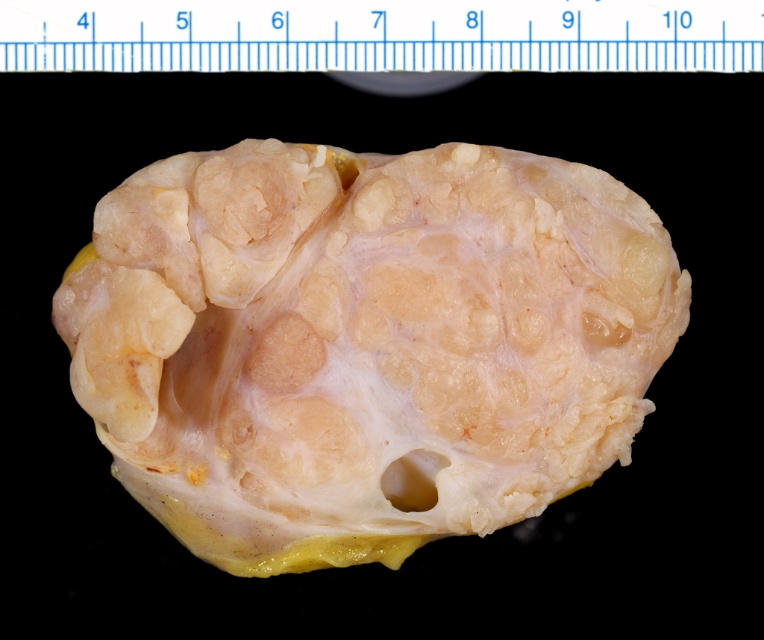
Consider the image. You are a medical student examining a tissue sample. You see the translucent yellowish flesh at center and the white plastic ruler at upper center. Which object is closer to you?

The white plastic ruler at upper center is closer to you because the translucent yellowish flesh at center is positioned under it.

From the picture: You are a surgeon preparing to perform a biopsy on the translucent yellowish flesh at center. The biopsy tool you have can only reach 3 feet. Can you safely perform the biopsy without moving the tool closer?

The distance between the surgeon and the translucent yellowish flesh at center is 3.75 feet, which is beyond the 3 feet reach of the biopsy tool. Therefore, the surgeon cannot safely perform the biopsy without moving the tool closer.

You are a medical student examining a tissue sample. You observe the translucent yellowish flesh at center. Based on its coordinates, where exactly is this feature positioned in the image?

The translucent yellowish flesh at center is located at point (364, 342).